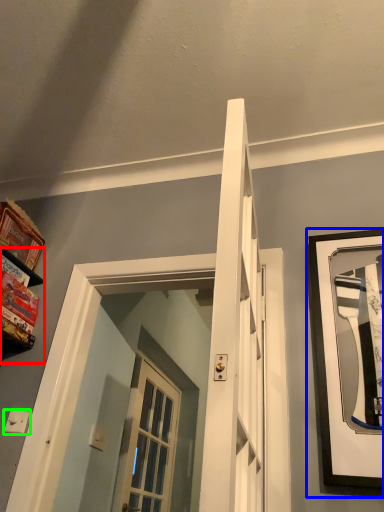
Question: Considering the real-world distances, which object is farthest from shelf (highlighted by a red box)? picture frame (highlighted by a blue box) or light switch (highlighted by a green box)?

Choices:
 (A) picture frame
 (B) light switch

Answer: (A)